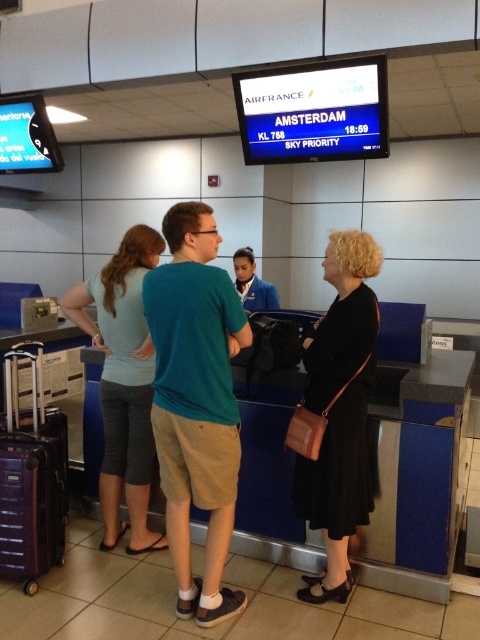
You are standing at the checkin counter and see two points in the scene. Which of the two points, point (215, 337) or point (7, 513), is closer to you?

Point (215, 337) is closer to the viewer than point (7, 513).

You are a passenger at the airport checkin counter. You see the teal fabric shirt at center and the maroon textured suitcase at lower left. Which object is closer to you?

The teal fabric shirt at center is closer to you because it is in front of the maroon textured suitcase at lower left.

You are standing at the checkin counter in the airport scene. You need to locate the teal fabric shirt at center. Can you tell me the coordinates of where it is located?

The teal fabric shirt at center is located at coordinates point (195, 403).